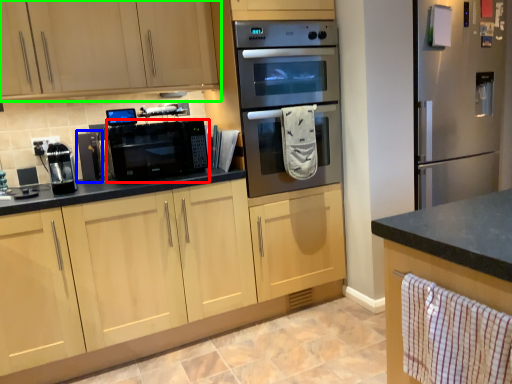
Question: Which object is the closest to the home appliance (highlighted by a red box)? Choose among these: appliance (highlighted by a blue box) or cabinetry (highlighted by a green box).

Choices:
 (A) appliance
 (B) cabinetry

Answer: (A)